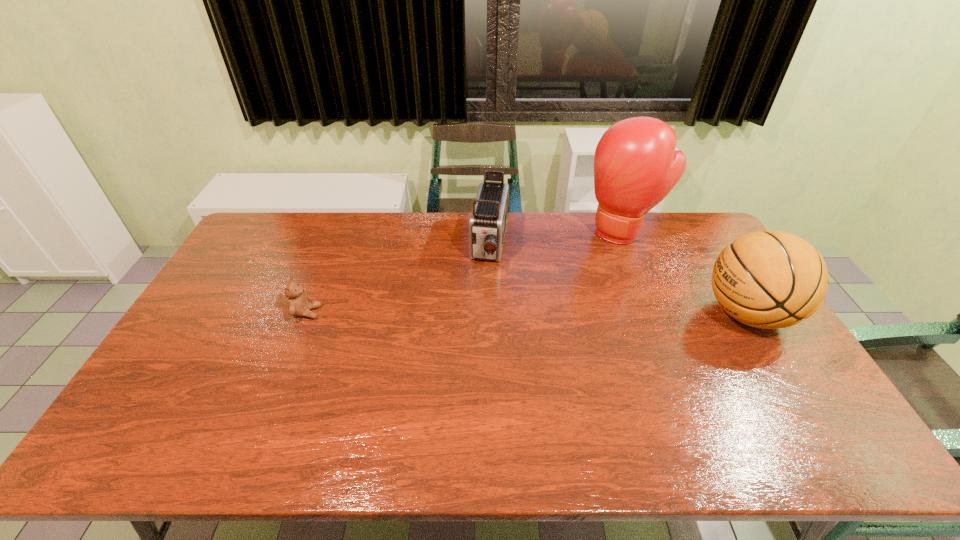
Identify the location of vacant space on the desktop that is between the teddy bear and the basketball and is positioned at the lens of the camcorder. (475, 313).

Where is `free space on the desktop that is between the shortest object and the basketball and is positioned on the striking surface of the boxing glove`? The height and width of the screenshot is (540, 960). free space on the desktop that is between the shortest object and the basketball and is positioned on the striking surface of the boxing glove is located at coordinates pyautogui.click(x=559, y=313).